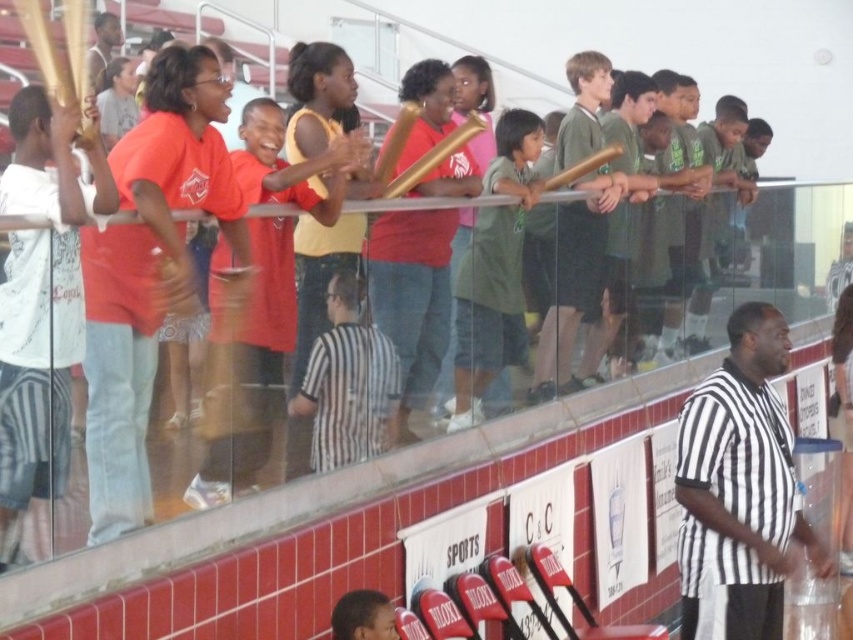
You are an event organizer trying to identify the size of the shirts worn by participants. Given that you see a matte red shirt at center and a green matte shirt at center, which one is smaller?

The matte red shirt at center is smaller than the green matte shirt at center.

You are a photographer positioned at the back of the bleachers. You want to take a photo that includes both the black and white striped shirt at center and the green matte shirt at center. Which shirt will appear smaller in the final photo?

The black and white striped shirt at center will appear smaller in the photo because it is physically smaller in size compared to the green matte shirt at center.

You are standing at the glass barrier in the sports event venue. There are two points marked in the image, point A at coordinates point A is point (744, 577) and point B at point (502, 230). Which point is closer to you?

Point A at coordinates point (744, 577) is closer to the viewer than point B at point (502, 230).